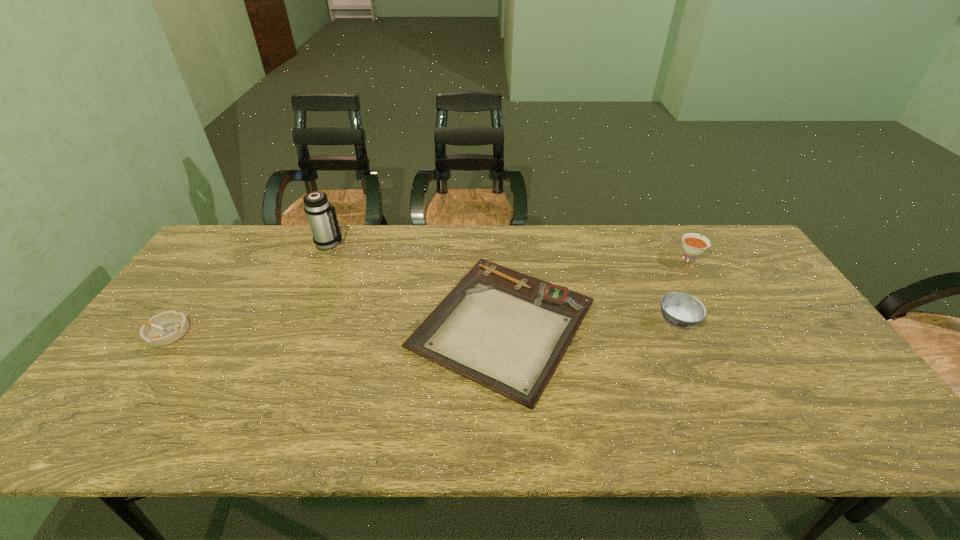
Where is `vacant area located on the side with the handle of the tallest object`? Image resolution: width=960 pixels, height=540 pixels. vacant area located on the side with the handle of the tallest object is located at coordinates [x=444, y=244].

The height and width of the screenshot is (540, 960). Identify the location of blank area located 0.130m on the side of the teacup with the handle. [671, 226].

Identify the location of vacant space located on the left of the taller ashtray. (516, 320).

The height and width of the screenshot is (540, 960). I want to click on free space located 0.050m on the front of the leftmost object, so click(x=144, y=363).

This screenshot has width=960, height=540. I want to click on vacant area situated 0.150m on the right of the third object from right to left, so click(x=654, y=323).

What are the coordinates of `thermos bottle at the far edge` in the screenshot? It's located at (320, 213).

At what (x,y) coordinates should I click in order to perform the action: click on teacup present at the far edge. Please return your answer as a coordinate pair (x, y). The height and width of the screenshot is (540, 960). Looking at the image, I should click on (693, 244).

This screenshot has width=960, height=540. I want to click on clipboard situated at the far edge, so click(x=507, y=331).

Find the location of `object located in the near edge section of the desktop`. object located in the near edge section of the desktop is located at coordinates (507, 331).

Locate an element on the screen. Image resolution: width=960 pixels, height=540 pixels. object present at the left edge is located at coordinates (167, 327).